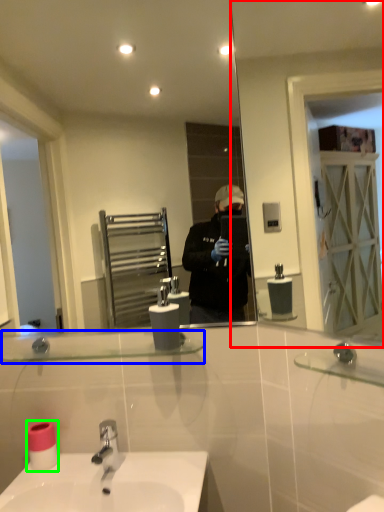
Question: Based on their relative distances, which object is nearer to mirror (highlighted by a red box)? Choose from balustrade (highlighted by a blue box) and toilet paper (highlighted by a green box).

Choices:
 (A) balustrade
 (B) toilet paper

Answer: (A)